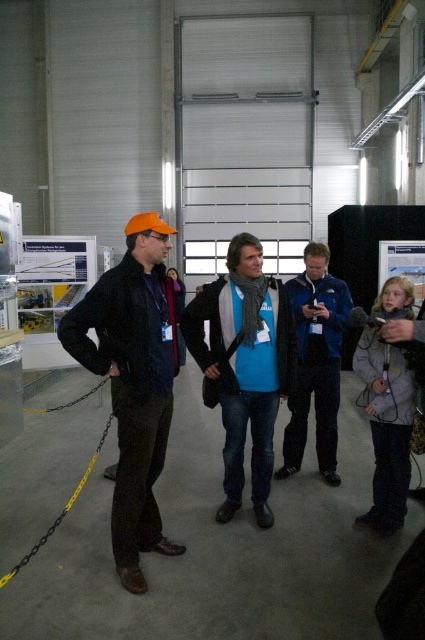
You are a delivery person entering the warehouse and see the matte black jacket at left and the blue matte shirt at center. Which one is nearer to you?

The matte black jacket at left is closer to the viewer than the blue matte shirt at center.

You are an interior designer assessing the space for a client. You notice the matte black jacket at left and the blue fabric jacket at center. Which jacket would you recommend placing in a smaller display area to maintain proportion with the room?

The matte black jacket at left is smaller than the blue fabric jacket at center, so it would be more appropriate to place the matte black jacket at left in the smaller display area to maintain proportion with the room.

You are a security guard in the warehouse. You need to check the width of the two people closest to you. The two people are the matte black jacket at left and the blue matte shirt at center. Which person has a narrower width?

The matte black jacket at left has a narrower width than the blue matte shirt at center.